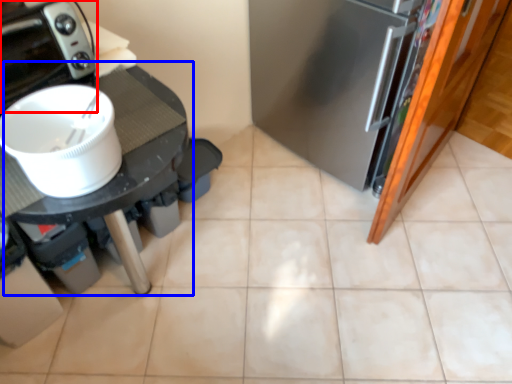
Question: Which object is closer to the camera taking this photo, home appliance (highlighted by a red box) or table (highlighted by a blue box)?

Choices:
 (A) home appliance
 (B) table

Answer: (B)